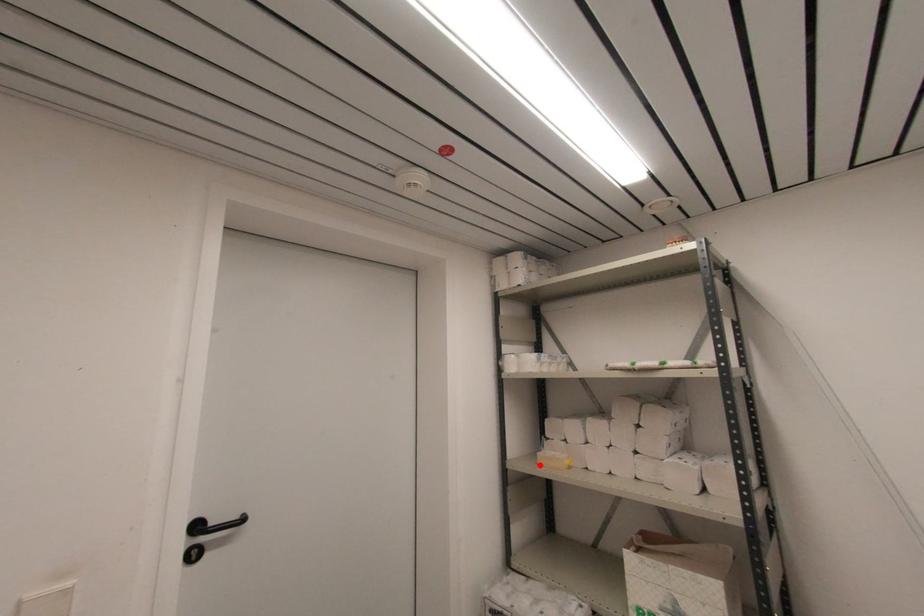
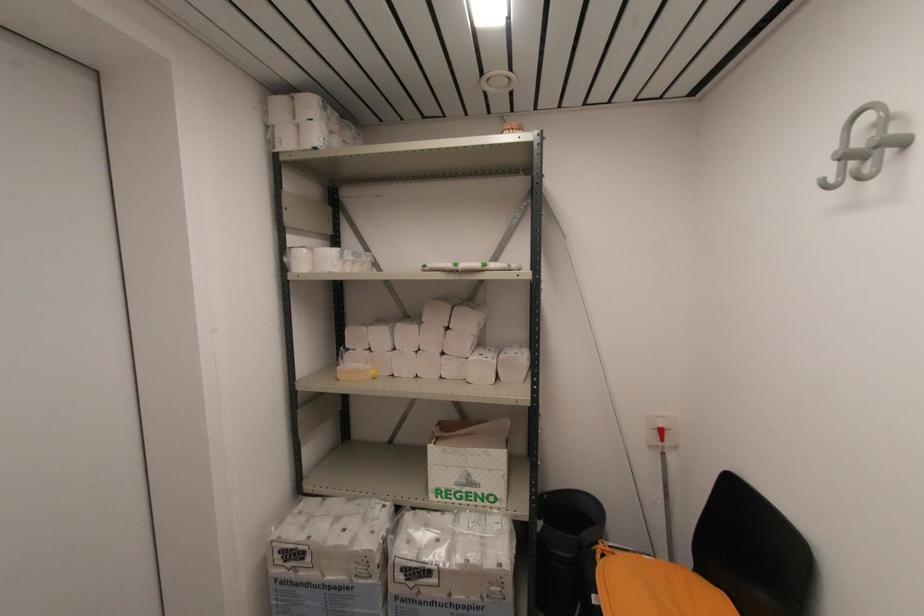
The point at the highlighted location is marked in the first image. Where is the corresponding point in the second image?

(339, 381)